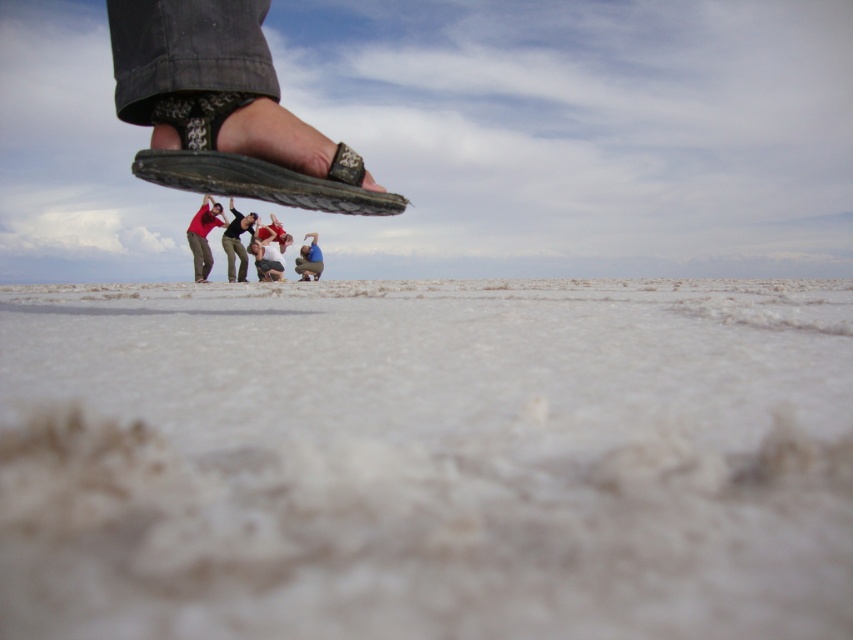
In the scene shown: You are a photographer trying to capture a photo of the matte black sandal at upper center and the matte blue shirt at lower center. Which object should you zoom in on to ensure both are clearly visible in the frame?

The matte black sandal at upper center is smaller than the matte blue shirt at lower center. To ensure both are clearly visible, you should zoom in on the matte black sandal at upper center since it is smaller and might need more focus to capture details.

You are an architect designing a scale model of this scene. The model requires precise placement of the black leather sandal at upper center. What are the coordinates for its position?

The coordinates for the black leather sandal at upper center are at point (265, 180).